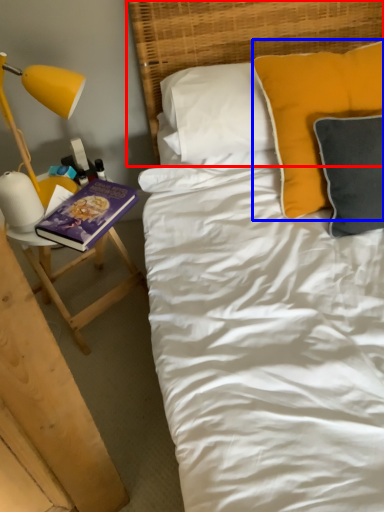
Question: Which object appears closest to the camera in this image, headboard (highlighted by a red box) or pillow (highlighted by a blue box)?

Choices:
 (A) headboard
 (B) pillow

Answer: (B)